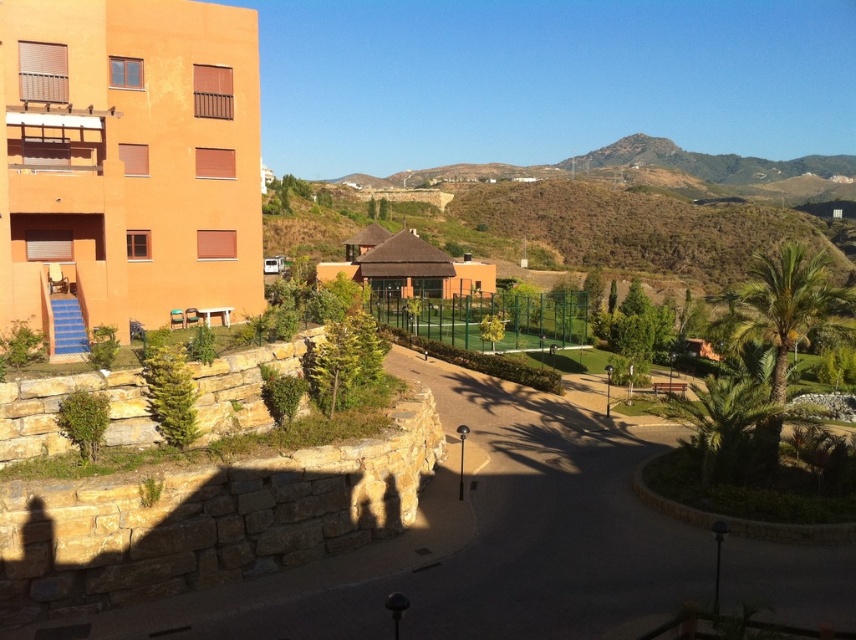
Question: Is orange stucco building at left closer to the viewer compared to green leafy palm tree at center-right?

Choices:
 (A) yes
 (B) no

Answer: (A)

Question: Among these points, which one is farthest from the camera?

Choices:
 (A) (853, 316)
 (B) (212, 161)

Answer: (B)

Question: Which object appears closest to the camera in this image?

Choices:
 (A) green leafy palm tree at center-right
 (B) orange stucco building at left

Answer: (B)

Question: Does orange stucco building at left come in front of green leafy palm tree at center-right?

Choices:
 (A) no
 (B) yes

Answer: (B)

Question: Does orange stucco building at left appear under green leafy palm tree at center-right?

Choices:
 (A) yes
 (B) no

Answer: (A)